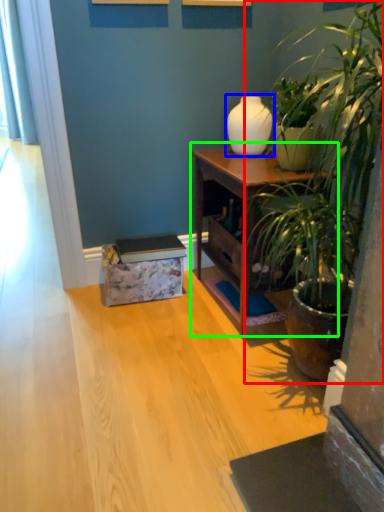
Question: Which object is positioned closest to houseplant (highlighted by a red box)? Select from vase (highlighted by a blue box) and nightstand (highlighted by a green box).

Choices:
 (A) vase
 (B) nightstand

Answer: (B)